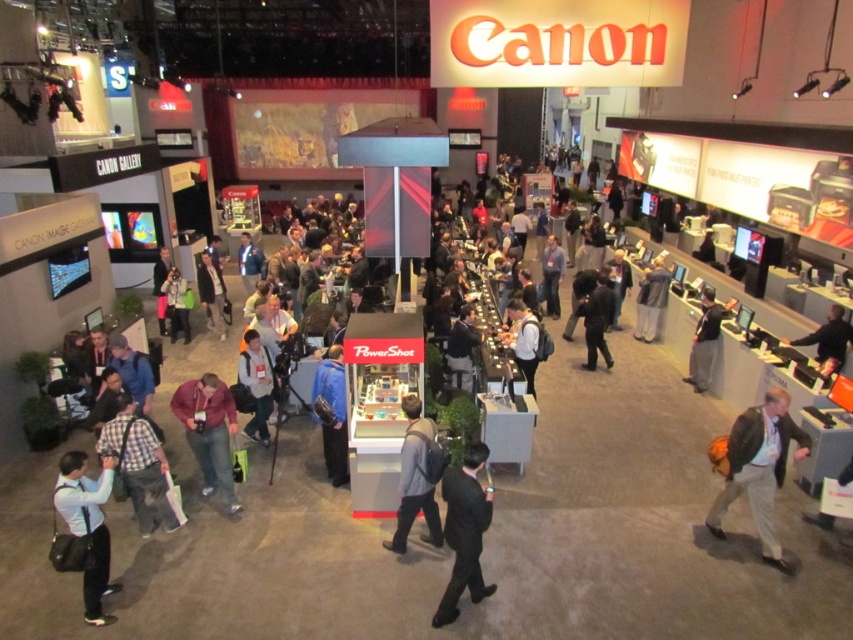
Does point (206, 378) come farther from viewer compared to point (183, 323)?

No.

Where is `red shirt at lower left`? red shirt at lower left is located at coordinates (209, 433).

Between point (236, 499) and point (167, 296), which one is positioned behind?

Point (167, 296)

Locate an element on the screen. This screenshot has width=853, height=640. red shirt at lower left is located at coordinates (209, 433).

From the picture: Can you confirm if red shirt at lower left is positioned to the left of blue fabric jacket at center?

Correct, you'll find red shirt at lower left to the left of blue fabric jacket at center.

Does red shirt at lower left appear on the right side of blue fabric jacket at center?

In fact, red shirt at lower left is to the left of blue fabric jacket at center.

The height and width of the screenshot is (640, 853). What do you see at coordinates (209, 433) in the screenshot?
I see `red shirt at lower left` at bounding box center [209, 433].

In order to click on red shirt at lower left in this screenshot , I will do `click(209, 433)`.

Can you confirm if light blue shirt at lower left is taller than black fabric shirt at center?

In fact, light blue shirt at lower left may be shorter than black fabric shirt at center.

Is light blue shirt at lower left to the left of black fabric shirt at center from the viewer's perspective?

Yes, light blue shirt at lower left is to the left of black fabric shirt at center.

Where is `light blue shirt at lower left`? Image resolution: width=853 pixels, height=640 pixels. light blue shirt at lower left is located at coordinates (86, 525).